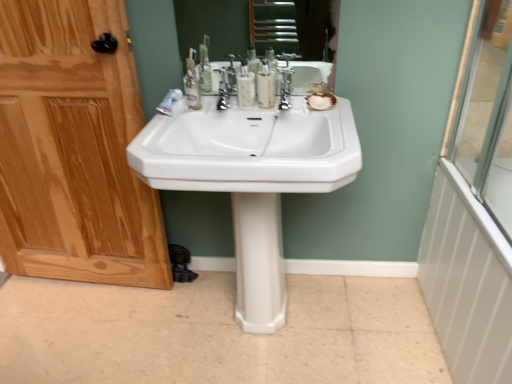
Find the location of a particular element. Image resolution: width=512 pixels, height=384 pixels. vacant area that lies to the right of white glossy pedestal at center is located at coordinates (316, 309).